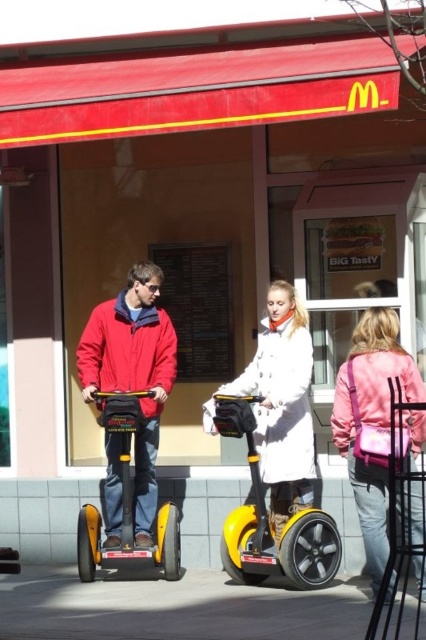
Does matte red jacket at center appear on the left side of pink fabric purse at lower right?

Yes, matte red jacket at center is to the left of pink fabric purse at lower right.

Is point (141, 528) less distant than point (373, 540)?

That is False.

Locate an element on the screen. The height and width of the screenshot is (640, 426). matte red jacket at center is located at coordinates (132, 372).

Is pink fabric purse at lower right shorter than yellow matte scooter at center?

No.

Which is below, pink fabric purse at lower right or yellow matte scooter at center?

yellow matte scooter at center is lower down.

Is point (394, 321) positioned after point (227, 554)?

That is False.

Image resolution: width=426 pixels, height=640 pixels. Identify the location of pink fabric purse at lower right. (371, 419).

How much distance is there between pink fabric purse at lower right and white fuzzy coat at center?

pink fabric purse at lower right is 27.31 inches from white fuzzy coat at center.

Measure the distance from pink fabric purse at lower right to white fuzzy coat at center.

They are 27.31 inches apart.

Does point (397, 348) come farther from viewer compared to point (267, 396)?

No, it is not.

Locate an element on the screen. The image size is (426, 640). pink fabric purse at lower right is located at coordinates (371, 419).